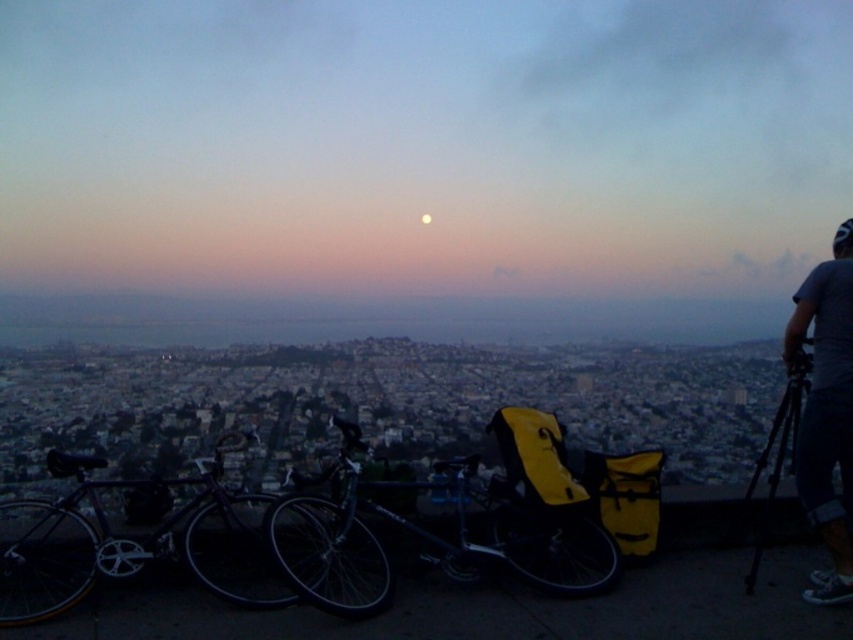
Question: Can you confirm if shiny metallic bicycle at center is thinner than black matte tripod at right?

Choices:
 (A) yes
 (B) no

Answer: (B)

Question: Does shiny metallic bicycle at center appear under blue denim shorts at right?

Choices:
 (A) no
 (B) yes

Answer: (B)

Question: Which object appears farthest from the camera in this image?

Choices:
 (A) shiny metallic bicycle at center
 (B) shiny black bicycle at left
 (C) blue denim shorts at right

Answer: (A)

Question: Is shiny black bicycle at left smaller than black matte tripod at right?

Choices:
 (A) yes
 (B) no

Answer: (B)

Question: Which of the following is the farthest from the observer?

Choices:
 (A) (483, 554)
 (B) (838, 598)
 (C) (224, 572)
 (D) (782, 461)

Answer: (D)

Question: Which object is closer to the camera taking this photo?

Choices:
 (A) blue denim shorts at right
 (B) black matte tripod at right
 (C) shiny black bicycle at left

Answer: (C)